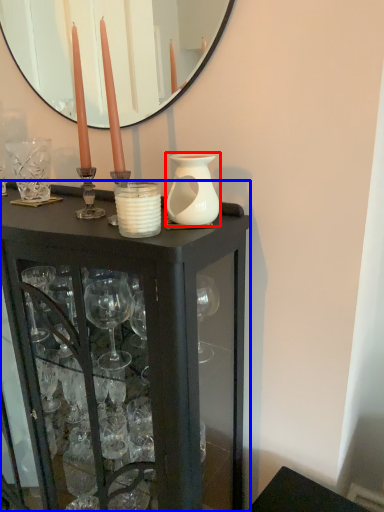
Question: Among these objects, which one is farthest to the camera, vase (highlighted by a red box) or table (highlighted by a blue box)?

Choices:
 (A) vase
 (B) table

Answer: (A)